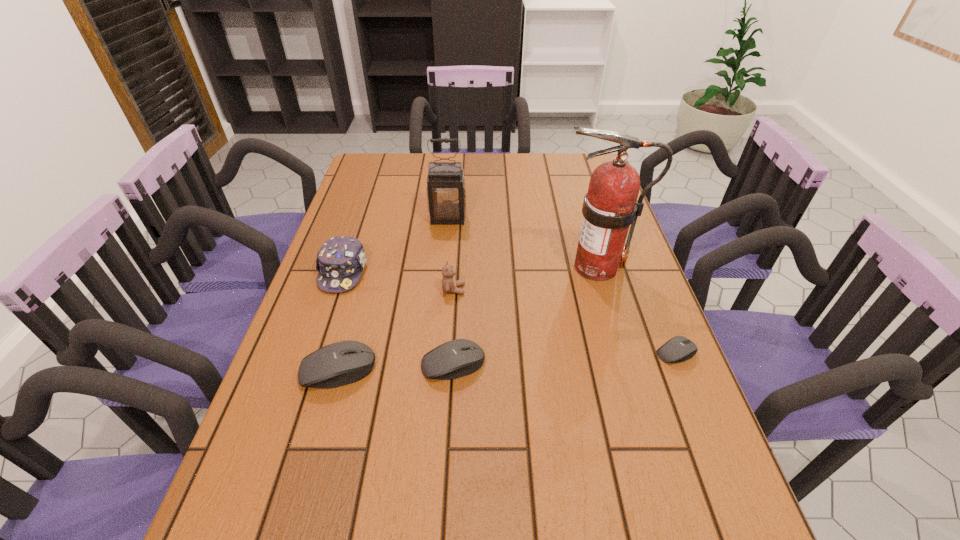
At what (x,y) coordinates should I click in order to perform the action: click on vacant space positioned on the front of the leftmost computer equipment. Please return your answer as a coordinate pair (x, y). This screenshot has height=540, width=960. Looking at the image, I should click on (313, 456).

This screenshot has height=540, width=960. What are the coordinates of `free spot located 0.190m on the right of the sixth tallest object` in the screenshot? It's located at (566, 364).

Where is `free spot located 0.200m on the left of the shortest computer equipment`? free spot located 0.200m on the left of the shortest computer equipment is located at coordinates point(572,353).

You are a GUI agent. You are given a task and a screenshot of the screen. Output one action in this format:
    pyautogui.click(x=<x>, y=<y>)
    Task: Click on the free point located on the front-facing side of the farthest object
    The image size is (960, 540).
    Given the screenshot: What is the action you would take?
    pyautogui.click(x=444, y=261)

This screenshot has width=960, height=540. Find the location of `free location located 0.320m on the front-facing side of the headwear`. free location located 0.320m on the front-facing side of the headwear is located at coordinates (300, 400).

Image resolution: width=960 pixels, height=540 pixels. I want to click on free space located 0.270m on the front-facing side of the teddy bear, so click(564, 289).

Find the location of a particular element. The height and width of the screenshot is (540, 960). vacant space located 0.300m at the nozzle of the tallest object is located at coordinates (450, 267).

At what (x,y) coordinates should I click in order to perform the action: click on vacant space located at the nozzle of the tallest object. Please return your answer as a coordinate pair (x, y). Looking at the image, I should click on (474, 267).

Identify the location of blank area located 0.390m at the nozzle of the tallest object. The width and height of the screenshot is (960, 540). (420, 267).

You are a GUI agent. You are given a task and a screenshot of the screen. Output one action in this format:
    pyautogui.click(x=<x>, y=<y>)
    Task: Click on the computer equipment at the left edge
    Image resolution: width=960 pixels, height=540 pixels.
    Given the screenshot: What is the action you would take?
    pyautogui.click(x=344, y=362)